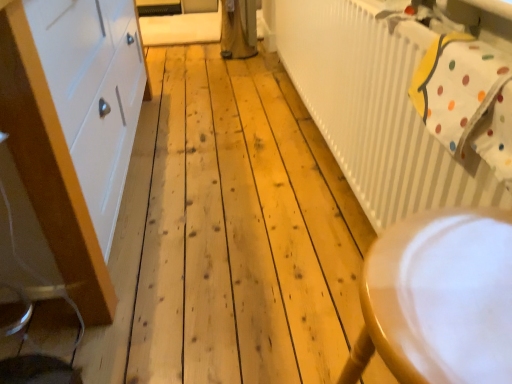
Question: Does wooden chair at lower right appear on the left side of white polka dot fabric at upper right?

Choices:
 (A) yes
 (B) no

Answer: (A)

Question: Considering the relative positions of wooden chair at lower right and white polka dot fabric at upper right in the image provided, is wooden chair at lower right behind white polka dot fabric at upper right?

Choices:
 (A) yes
 (B) no

Answer: (B)

Question: Considering the relative sizes of wooden chair at lower right and white polka dot fabric at upper right in the image provided, is wooden chair at lower right wider than white polka dot fabric at upper right?

Choices:
 (A) no
 (B) yes

Answer: (B)

Question: From a real-world perspective, does wooden chair at lower right stand above white polka dot fabric at upper right?

Choices:
 (A) no
 (B) yes

Answer: (A)

Question: Is wooden chair at lower right located outside white polka dot fabric at upper right?

Choices:
 (A) yes
 (B) no

Answer: (A)

Question: Considering the relative sizes of wooden chair at lower right and white polka dot fabric at upper right in the image provided, is wooden chair at lower right shorter than white polka dot fabric at upper right?

Choices:
 (A) yes
 (B) no

Answer: (B)

Question: Does white painted wood cabinet at left have a greater height compared to wooden chair at lower right?

Choices:
 (A) no
 (B) yes

Answer: (B)

Question: Does white painted wood cabinet at left have a smaller size compared to wooden chair at lower right?

Choices:
 (A) yes
 (B) no

Answer: (B)

Question: Does white painted wood cabinet at left appear on the left side of wooden chair at lower right?

Choices:
 (A) no
 (B) yes

Answer: (B)

Question: Is wooden chair at lower right completely or partially inside white painted wood cabinet at left?

Choices:
 (A) no
 (B) yes

Answer: (A)

Question: Is there a large distance between white painted wood cabinet at left and wooden chair at lower right?

Choices:
 (A) no
 (B) yes

Answer: (B)

Question: From the image's perspective, is white painted wood cabinet at left beneath wooden chair at lower right?

Choices:
 (A) yes
 (B) no

Answer: (B)

Question: From a real-world perspective, is white polka dot fabric at upper right on top of white painted wood cabinet at left?

Choices:
 (A) no
 (B) yes

Answer: (B)